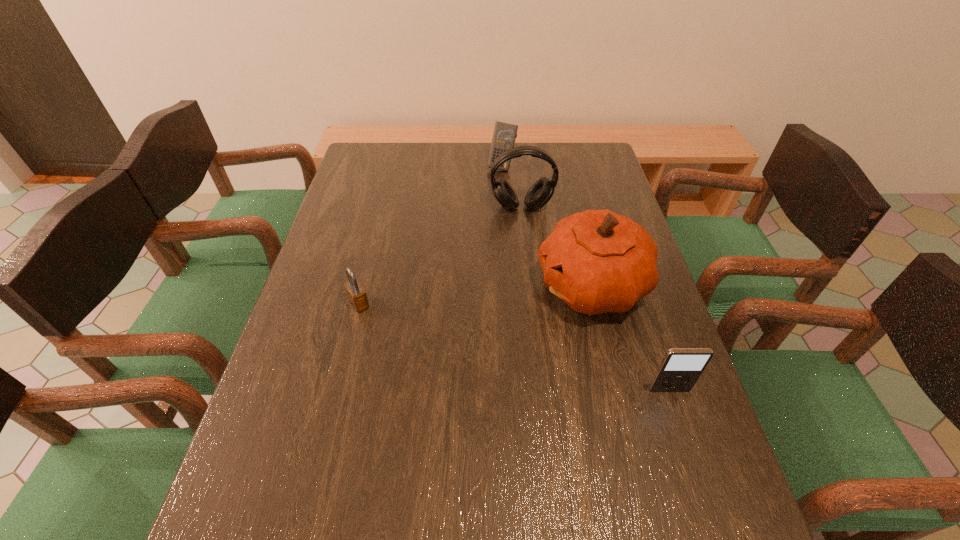
In order to click on pumpkin that is at the right edge in this screenshot , I will do `click(597, 261)`.

Where is `vacant space at the far edge of the desktop`? The height and width of the screenshot is (540, 960). vacant space at the far edge of the desktop is located at coordinates (468, 148).

Find the location of `vacant space at the near edge of the desktop`. vacant space at the near edge of the desktop is located at coordinates (350, 473).

Identify the location of free space at the right edge of the desktop. Image resolution: width=960 pixels, height=540 pixels. (695, 444).

Image resolution: width=960 pixels, height=540 pixels. In the image, there is a desktop. What are the coordinates of `vacant region at the far left corner` in the screenshot? It's located at (392, 158).

The width and height of the screenshot is (960, 540). I want to click on vacant space at the near left corner, so click(x=257, y=480).

Image resolution: width=960 pixels, height=540 pixels. Identify the location of vacant space at the far right corner of the desktop. (567, 167).

Where is `unoccupied area between the shortest object and the calculator`? The width and height of the screenshot is (960, 540). unoccupied area between the shortest object and the calculator is located at coordinates (430, 235).

This screenshot has height=540, width=960. Identify the location of free space that is in between the shortest object and the pumpkin. (476, 295).

This screenshot has width=960, height=540. Identify the location of vacant space that's between the shortest object and the farthest object. (430, 235).